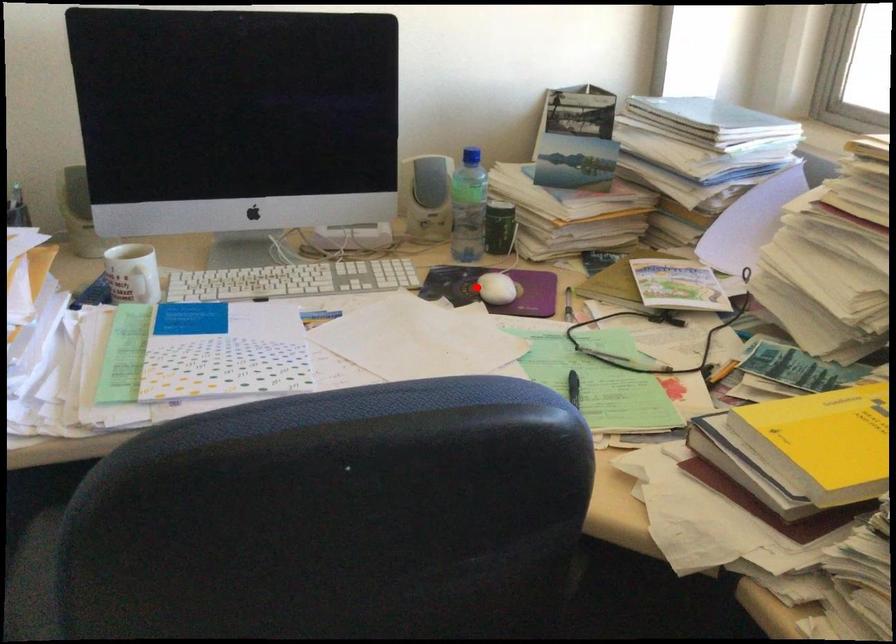
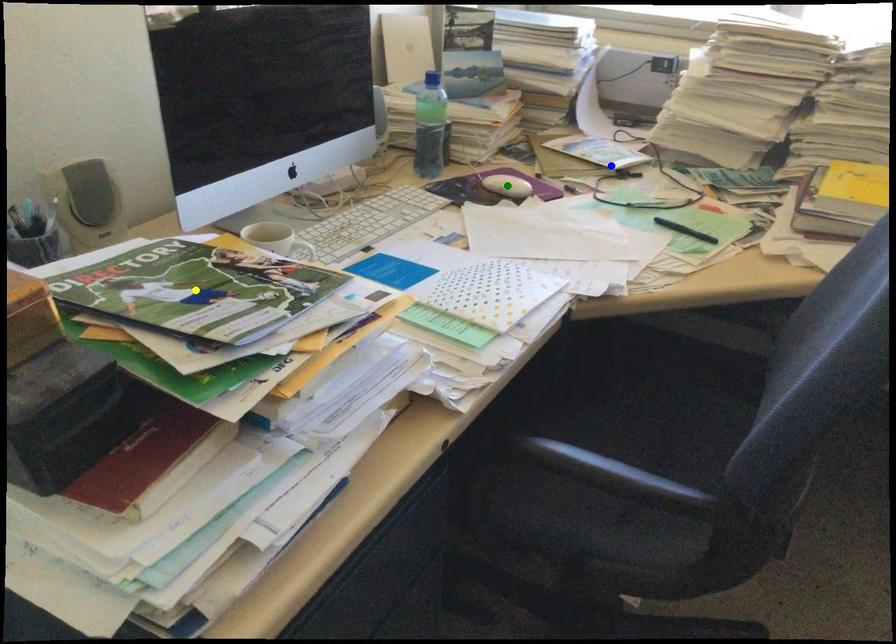
Question: I am providing you with two images of the same scene from different viewpoints. A red point is marked on the first image. You are given multiple points on the second image. Which point in image 2 is actually the same real-world point as the red point in image 1?

Choices:
 (A) green point
 (B) blue point
 (C) yellow point

Answer: (A)